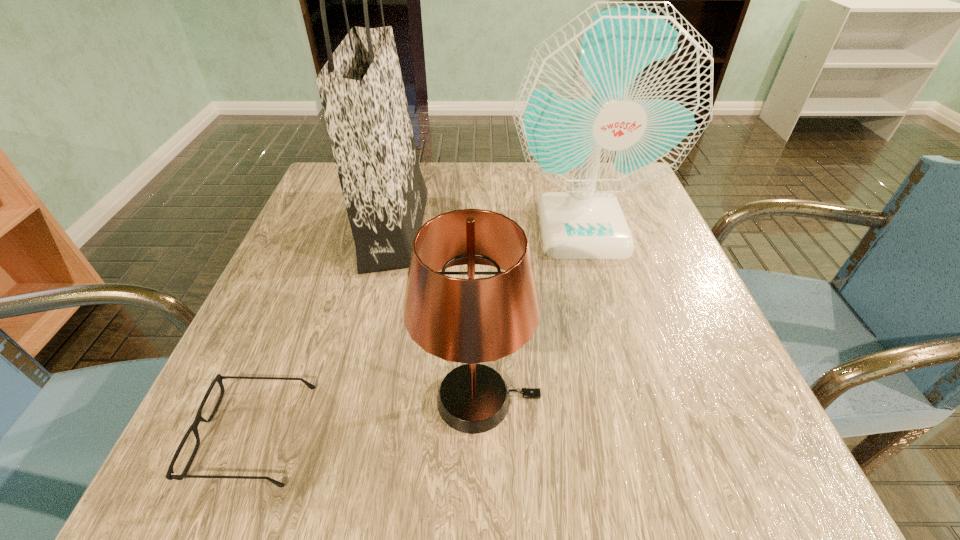
Find the location of a particular element. The width and height of the screenshot is (960, 540). free space at the left edge of the desktop is located at coordinates point(282,340).

Identify the location of free space at the right edge of the desktop. (650, 261).

The image size is (960, 540). Find the location of `vacant space that is in between the shortest object and the third object from right to left`. vacant space that is in between the shortest object and the third object from right to left is located at coordinates (324, 331).

Locate an element on the screen. object identified as the second closest to the leftmost object is located at coordinates (361, 89).

Select which object is the closest to the fan. Please provide its 2D coordinates. Your answer should be formatted as a tuple, i.e. [(x, y)], where the tuple contains the x and y coordinates of a point satisfying the conditions above.

[(361, 89)]

Find the location of `free spot that satisfies the following two spatial constraints: 1. in front of the fan to face the airflow; 2. on the front-facing side of the third tallest object`. free spot that satisfies the following two spatial constraints: 1. in front of the fan to face the airflow; 2. on the front-facing side of the third tallest object is located at coordinates (630, 400).

In order to click on vacant space that satisfies the following two spatial constraints: 1. in front of the fan to face the airflow; 2. on the front-facing side of the lampshade in this screenshot , I will do `click(630, 400)`.

Find the location of a particular element. vacant space that satisfies the following two spatial constraints: 1. in front of the fan to face the airflow; 2. on the front-facing side of the second shortest object is located at coordinates (630, 400).

Image resolution: width=960 pixels, height=540 pixels. I want to click on vacant space that satisfies the following two spatial constraints: 1. in front of the fan to face the airflow; 2. on the front of the shopping bag with the design, so click(582, 229).